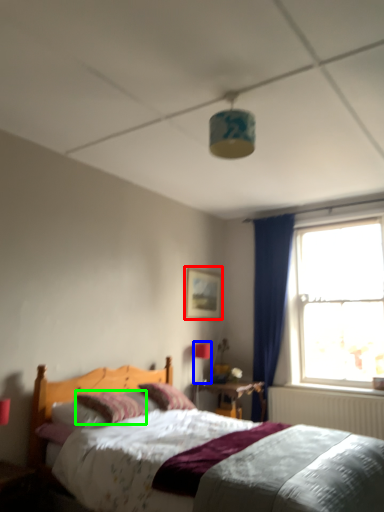
Question: Considering the real-world distances, which object is farthest from picture frame (highlighted by a red box)? light fixture (highlighted by a blue box) or pillow (highlighted by a green box)?

Choices:
 (A) light fixture
 (B) pillow

Answer: (B)